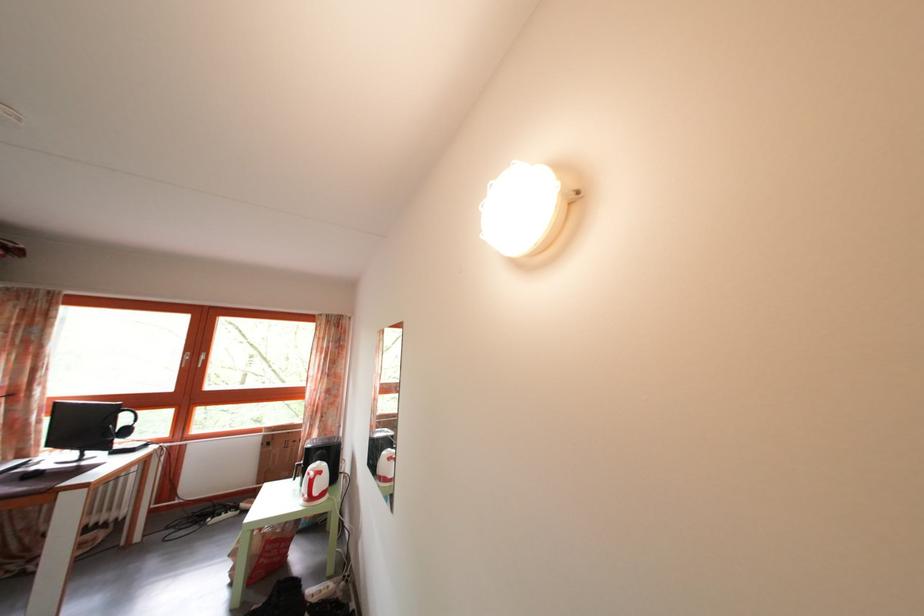
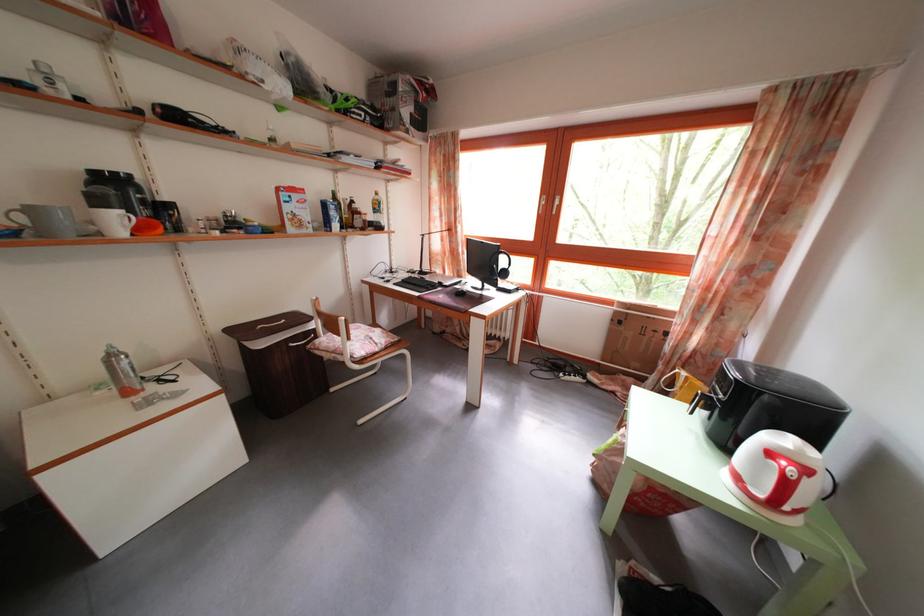
Find the pixel in the second image that matches the point at 99,429 in the first image.

(492, 265)